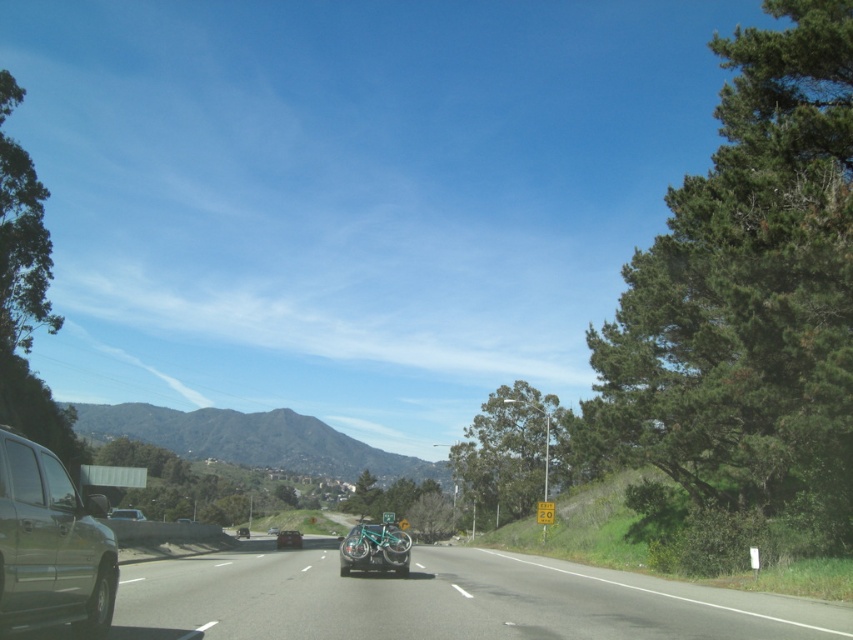
Question: Where is metallic silver car at lower left located in relation to metallic green suv at left in the image?

Choices:
 (A) right
 (B) left

Answer: (A)

Question: Is teal metallic bicycle at center positioned before metallic silver suv at center?

Choices:
 (A) yes
 (B) no

Answer: (A)

Question: Can you confirm if metallic silver car at lower left is positioned to the right of matte black suv at lower left?

Choices:
 (A) yes
 (B) no

Answer: (A)

Question: Among these objects, which one is farthest from the camera?

Choices:
 (A) teal metallic bicycle at center
 (B) silver metallic sedan at center
 (C) metallic green suv at left

Answer: (B)

Question: Which point is closer to the camera?

Choices:
 (A) silver metallic sedan at center
 (B) matte black suv at lower left

Answer: (B)

Question: Which object is the farthest from the teal metallic bicycle at center?

Choices:
 (A) metallic green suv at left
 (B) silver metallic sedan at center

Answer: (B)